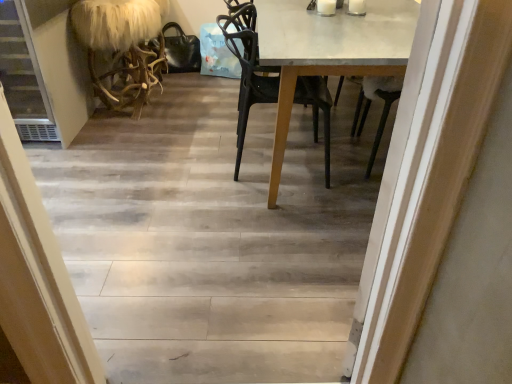
Question: Is fuzzy white fur at left not close to wooden floor at center?

Choices:
 (A) yes
 (B) no

Answer: (B)

Question: Can you confirm if fuzzy white fur at left is positioned to the left of wooden floor at center?

Choices:
 (A) yes
 (B) no

Answer: (A)

Question: Is fuzzy white fur at left taller than wooden floor at center?

Choices:
 (A) yes
 (B) no

Answer: (A)

Question: From a real-world perspective, is fuzzy white fur at left positioned under wooden floor at center based on gravity?

Choices:
 (A) no
 (B) yes

Answer: (A)

Question: Does fuzzy white fur at left come behind wooden floor at center?

Choices:
 (A) yes
 (B) no

Answer: (A)

Question: From the image's perspective, is fuzzy white fur at left above wooden floor at center?

Choices:
 (A) no
 (B) yes

Answer: (B)

Question: Does fuzzy white fur at left have a larger size compared to black matte chair at center?

Choices:
 (A) yes
 (B) no

Answer: (B)

Question: Is fuzzy white fur at left closer to camera compared to black matte chair at center?

Choices:
 (A) no
 (B) yes

Answer: (A)

Question: Is fuzzy white fur at left at the right side of black matte chair at center?

Choices:
 (A) no
 (B) yes

Answer: (A)

Question: Considering the relative sizes of fuzzy white fur at left and black matte chair at center in the image provided, is fuzzy white fur at left smaller than black matte chair at center?

Choices:
 (A) no
 (B) yes

Answer: (B)

Question: Is fuzzy white fur at left wider than black matte chair at center?

Choices:
 (A) no
 (B) yes

Answer: (A)

Question: Does fuzzy white fur at left have a lesser width compared to black matte chair at center?

Choices:
 (A) no
 (B) yes

Answer: (B)

Question: From the image's perspective, is wooden floor at center located beneath fuzzy white fur at left?

Choices:
 (A) no
 (B) yes

Answer: (B)